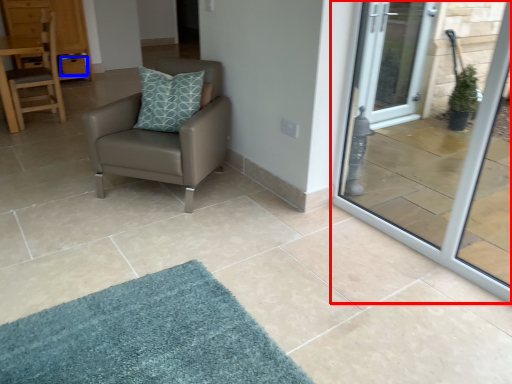
Question: Which point is closer to the camera, door (highlighted by a red box) or drawer (highlighted by a blue box)?

Choices:
 (A) door
 (B) drawer

Answer: (A)